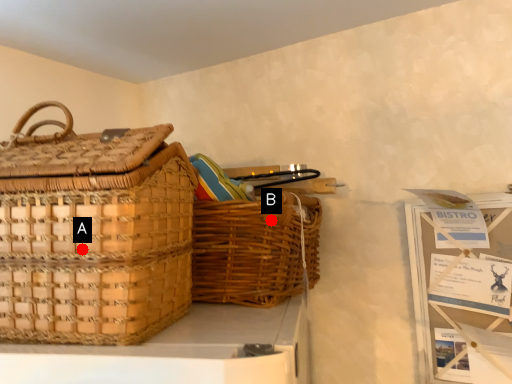
Question: Two points are circled on the image, labeled by A and B beside each circle. Which point is farther to the camera?

Choices:
 (A) A is further
 (B) B is further

Answer: (B)